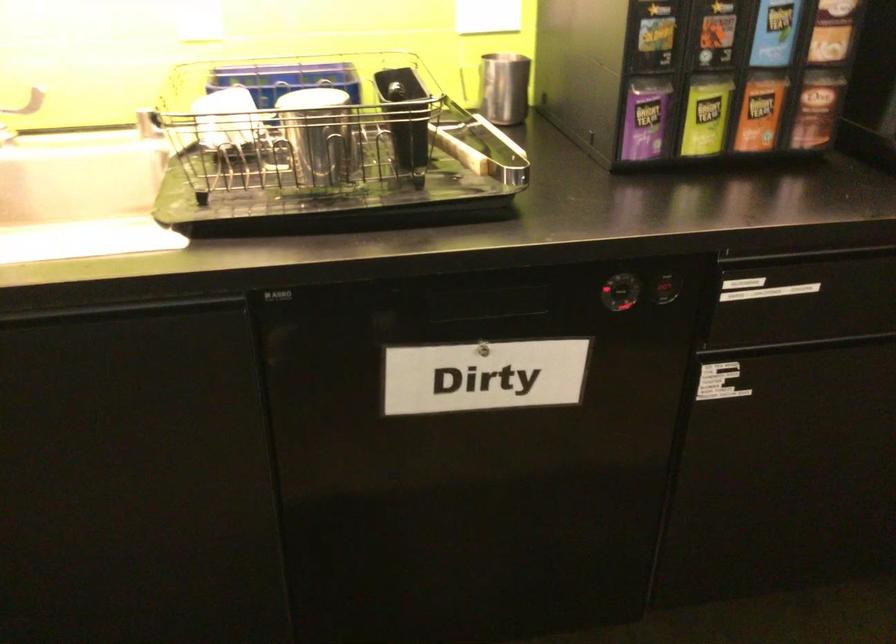
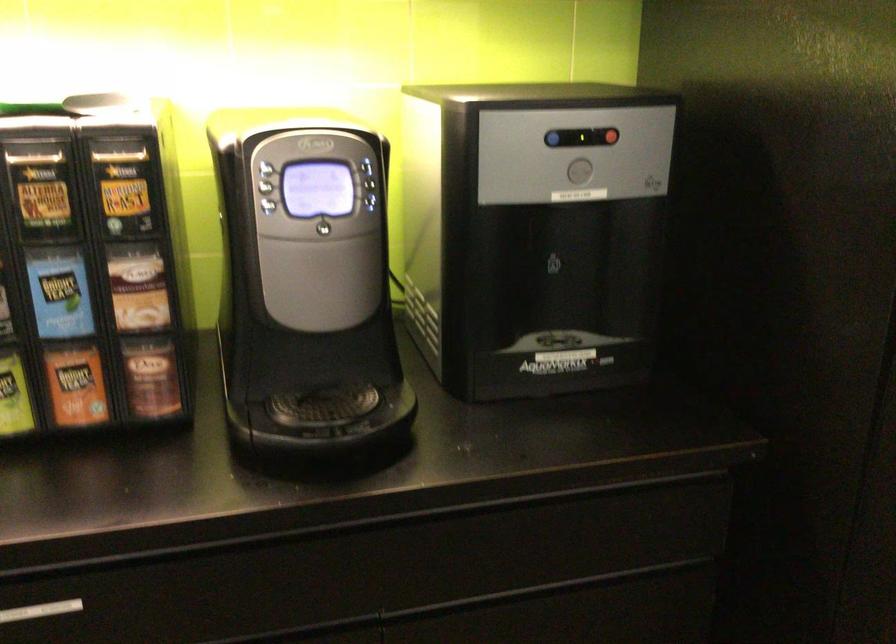
In the second image, find the point that corresponds to (786,295) in the first image.

(40, 611)